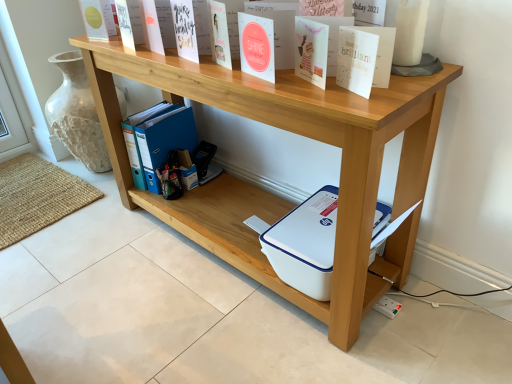
Locate an element on the screen. free point in front of matte blue notebook at upper center, marked as the 2th paperback book in a back-to-front arrangement is located at coordinates (203, 71).